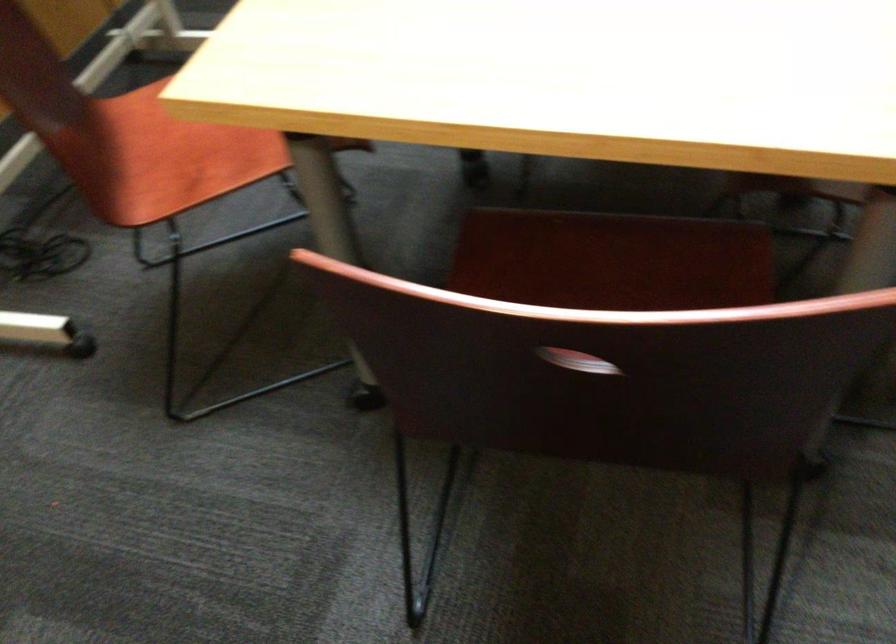
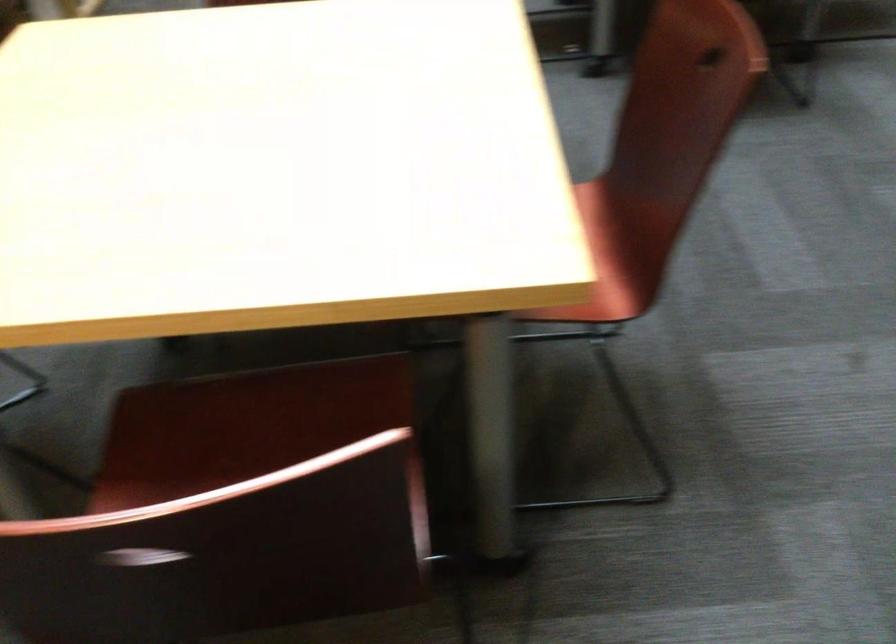
Question: How did the camera likely rotate?

Choices:
 (A) Left
 (B) Right
 (C) Up
 (D) Down

Answer: (B)